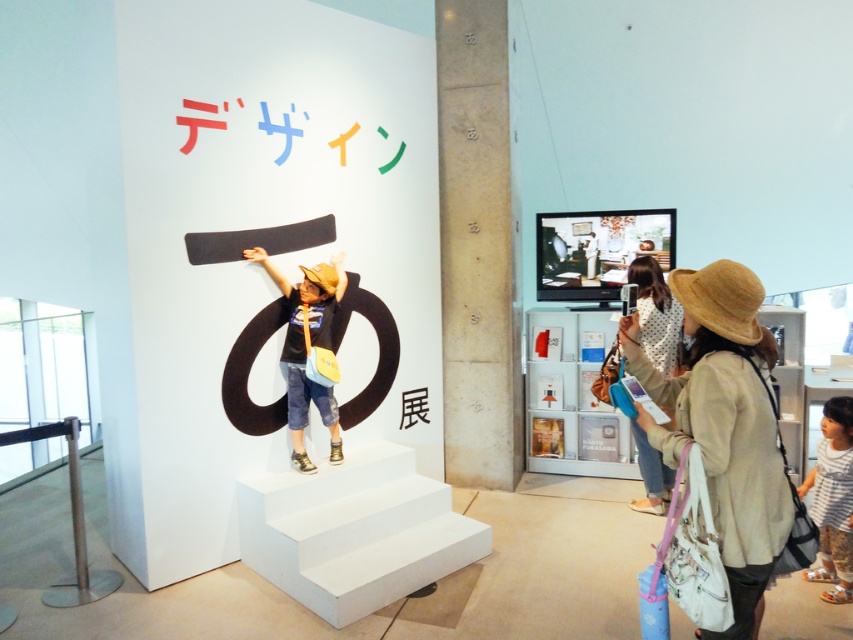
You are an art curator planning to move the beige straw hat at right and the denim shorts at center to a new exhibition layout. If you want to keep their relative positions the same as in the current scene, which object should be placed to the right of the other?

The beige straw hat at right should be placed to the right of the denim shorts at center to maintain their relative positions as in the current scene.

You are an artist standing in the exhibition space and want to sketch the beige straw hat at right. Based on its coordinates, where should you position yourself to get the best view of the hat?

The beige straw hat at right is located at point 0.664 on the x and 0.850 on the y. To get the best view, position yourself directly in front of the hat along the x and y coordinates, ensuring you are facing it squarely.

You are a visitor in the exhibition space and want to place a 2 meter long banner between the beige straw hat at right and the light brown straw hat at center. Can you fit the banner between them without bending it?

The distance between the beige straw hat at right and the light brown straw hat at center is 1.98 meters. Since the banner is 2 meters long, it is slightly longer than the available space. Therefore, the banner cannot be placed straight between them without bending.